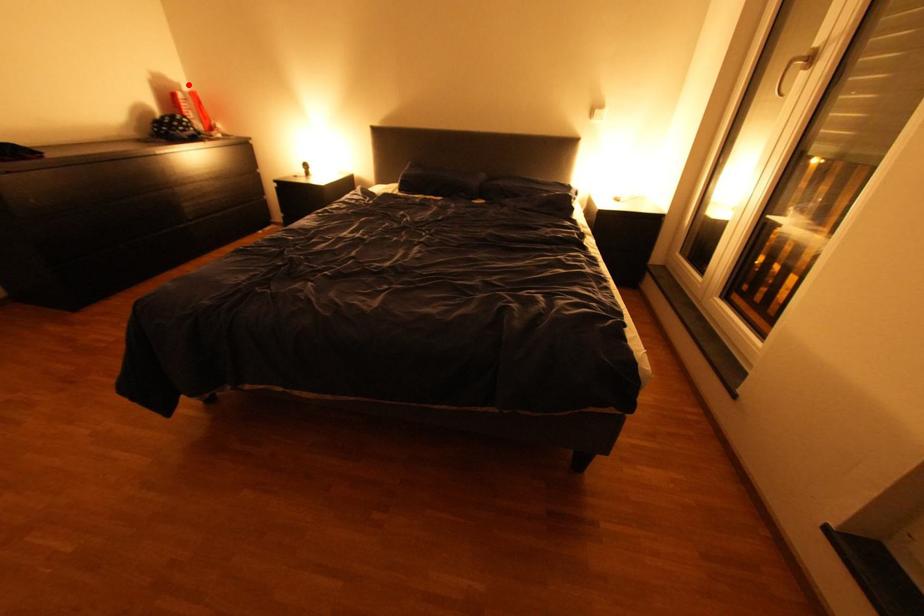
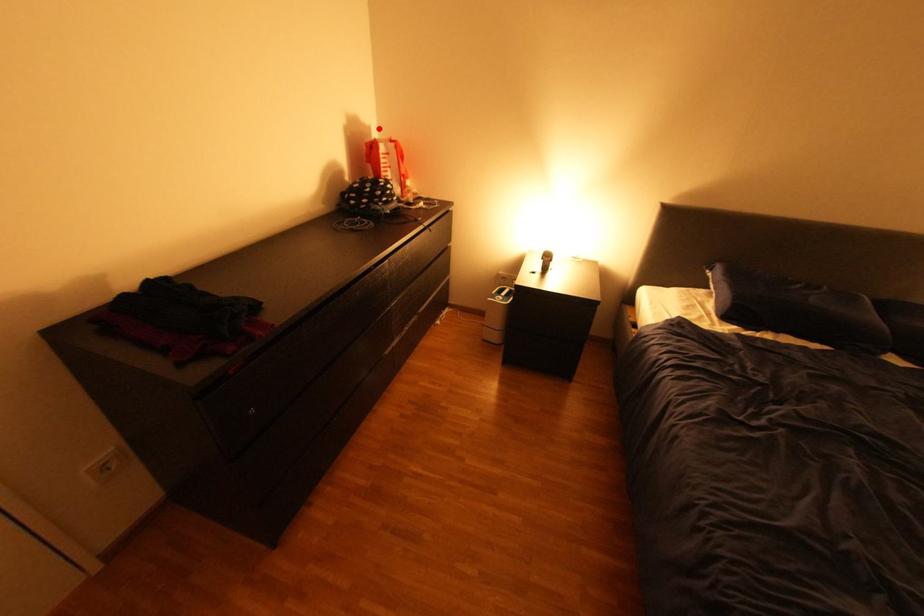
I am providing you with two images of the same scene from different viewpoints. A red point is marked on the first image and another point is marked on the second image. Are the points marked in image1 and image2 representing the same 3D position?

Yes